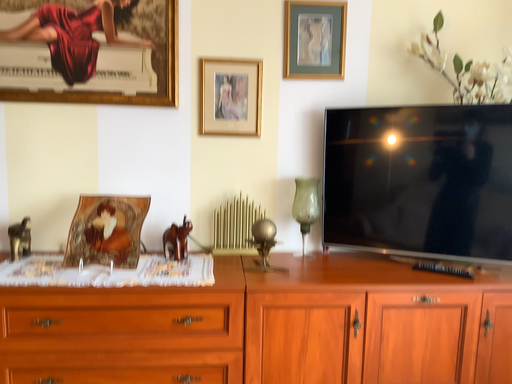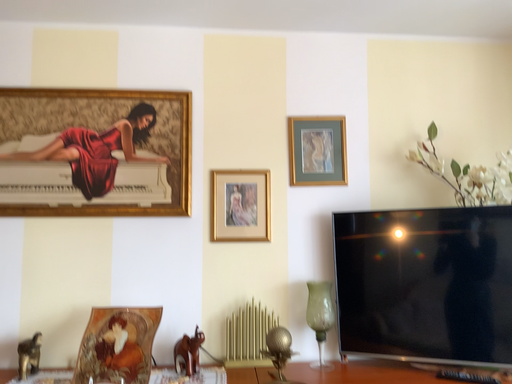
Question: Which way did the camera rotate in the video?

Choices:
 (A) rotated upward
 (B) rotated downward

Answer: (A)